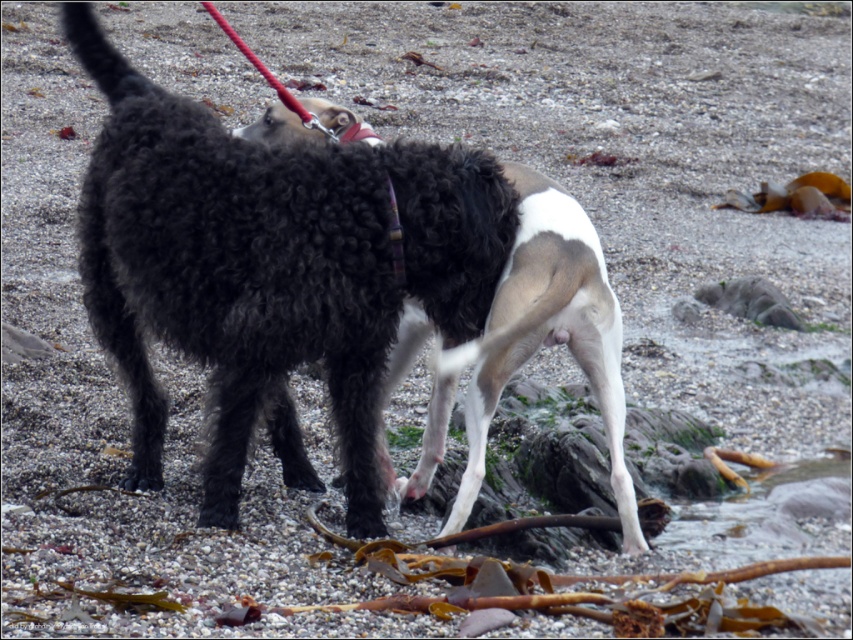
You are a photographer trying to capture a clear shot of both the curly black fur at center and the plaid fabric neckband at center. Since you want to ensure both are in focus, which object should you adjust your camera focus on first to account for their height difference?

The curly black fur at center is taller than the plaid fabric neckband at center, so you should focus on the taller object first to ensure depth of field covers both.

You are a photographer trying to capture a clear shot of both the curly black fur at center and the plaid fabric neckband at center. Based on their positions, which one is closer to the camera?

The curly black fur at center is closer to the camera since it is in front of the plaid fabric neckband at center.

Looking at this image, you are a photographer trying to capture a closeup shot of both the curly black fur at center and the plaid fabric neckband at center. Given that your camera has a maximum focus range of 30 inches, will you be able to capture both objects in focus without moving the camera or the subjects?

The distance between the curly black fur at center and the plaid fabric neckband at center is 33.61 inches, which exceeds the camera maximum focus range of 30 inches. Therefore, you cannot capture both objects in focus without adjusting the camera or moving the subjects.